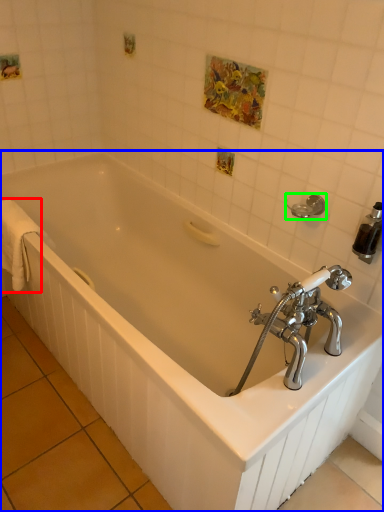
Question: Based on their relative distances, which object is farther from bath towel (highlighted by a red box)? Choose from bathtub (highlighted by a blue box) and towel bar (highlighted by a green box).

Choices:
 (A) bathtub
 (B) towel bar

Answer: (B)